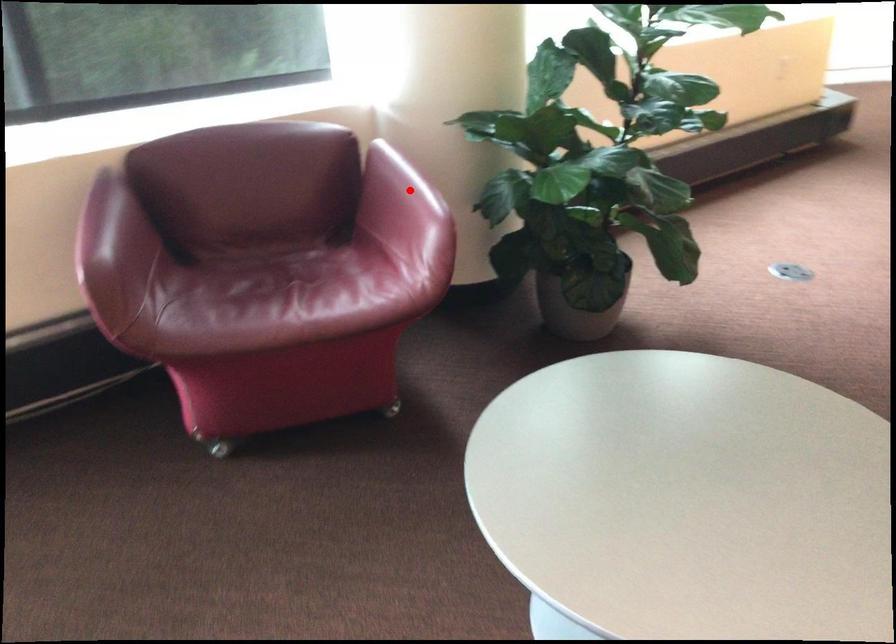
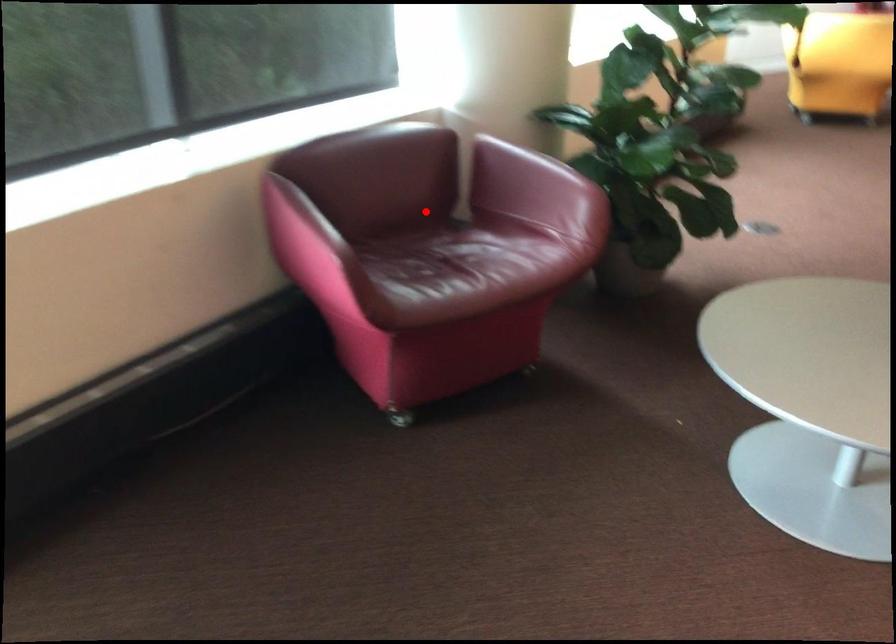
I am providing you with two images of the same scene from different viewpoints. A red point is marked on the first image and another point is marked on the second image. Are the points marked in image1 and image2 representing the same 3D position?

No